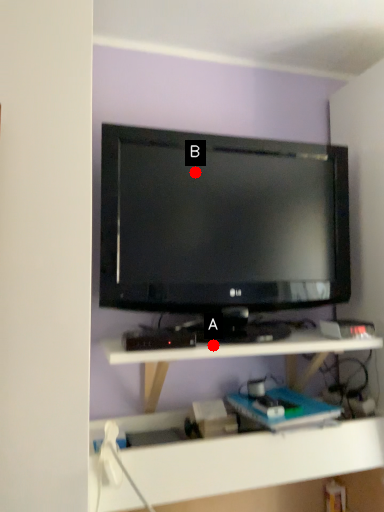
Question: Two points are circled on the image, labeled by A and B beside each circle. Which of the following is the farthest from the observer?

Choices:
 (A) A is further
 (B) B is further

Answer: (B)